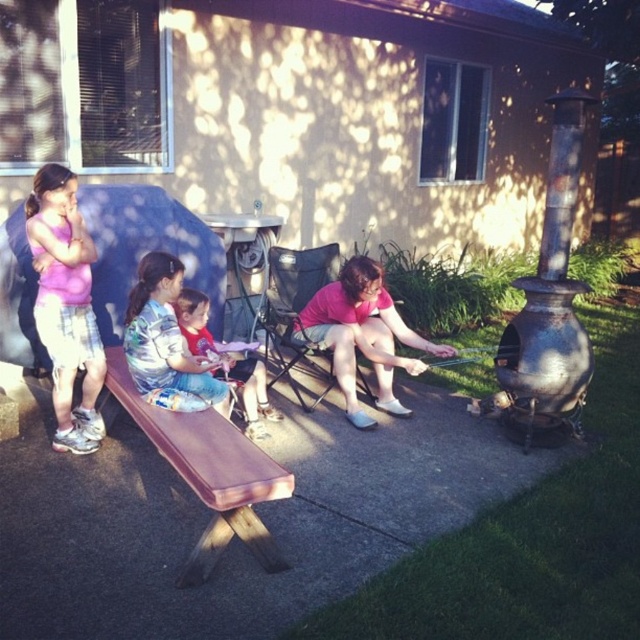
You are a photographer trying to capture a photo of the matte pink shirt at left and the brown wooden picnic table at center. Based on their heights, which object should you focus on first if you want to ensure both are in the frame without adjusting your camera angle?

The matte pink shirt at left is taller than the brown wooden picnic table at center, so you should focus on the matte pink shirt at left first to ensure both are in the frame.

Consider the image. You are standing at the picnic table and want to move towards the fireplace. Which point, point (225, 477) or point (132, 300), is closer to you as you start moving towards the fireplace?

Point (225, 477) is closer to the viewer than point (132, 300), so it is closer to you as you start moving towards the fireplace.